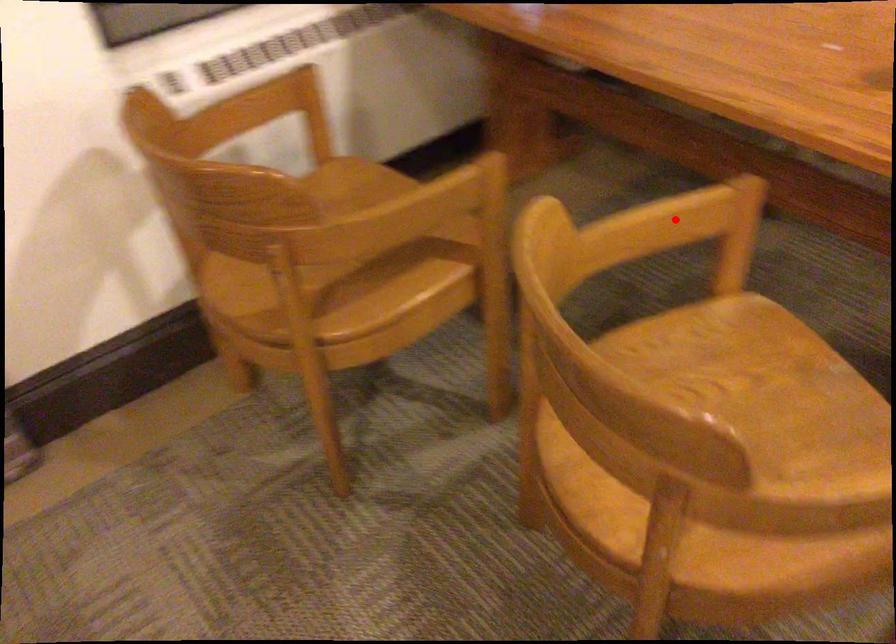
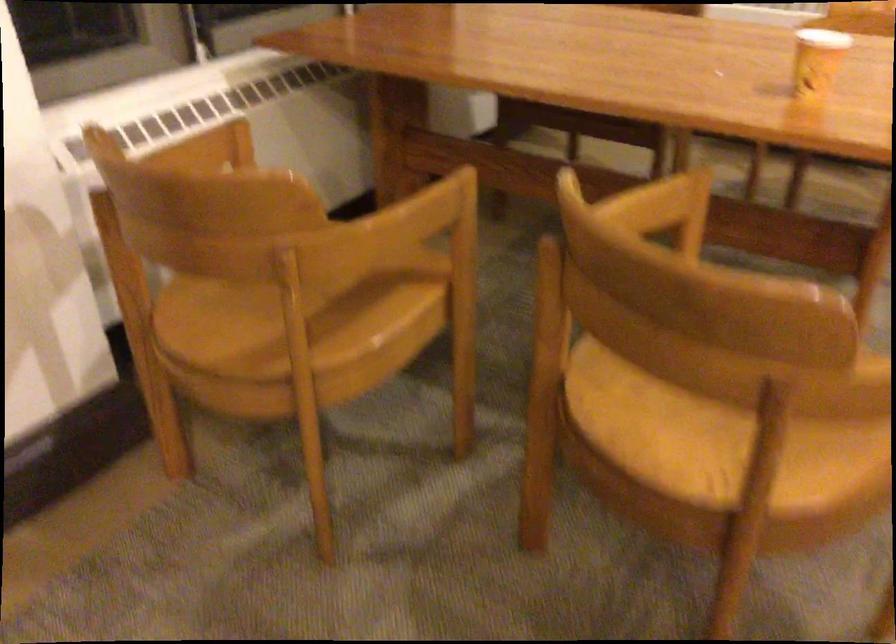
Question: A red point is marked in image1. In image2, is the corresponding 3D point closer to the camera or farther? Reply with the corresponding letter.

Choices:
 (A) The corresponding 3D point is closer.
 (B) The corresponding 3D point is farther.

Answer: (B)